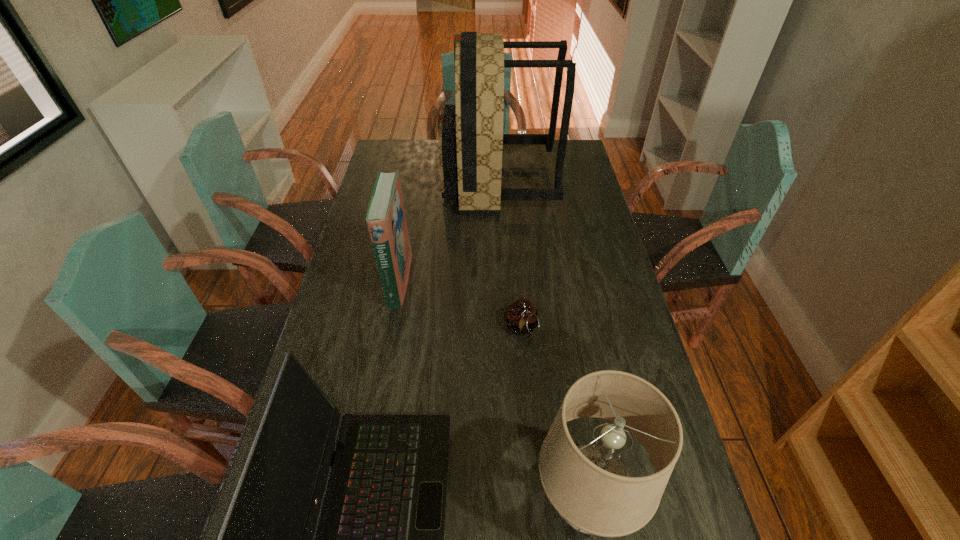
You are a GUI agent. You are given a task and a screenshot of the screen. Output one action in this format:
    pyautogui.click(x=<x>, y=<y>)
    Task: Click on the farthest object
    The width and height of the screenshot is (960, 540).
    Given the screenshot: What is the action you would take?
    pyautogui.click(x=471, y=139)

Locate an element on the screen. This screenshot has width=960, height=540. the tallest object is located at coordinates (471, 139).

Identify the location of hardback book. The width and height of the screenshot is (960, 540). (386, 220).

Where is `the third farthest object`? The height and width of the screenshot is (540, 960). the third farthest object is located at coordinates (521, 318).

You are a GUI agent. You are given a task and a screenshot of the screen. Output one action in this format:
    pyautogui.click(x=<x>, y=<y>)
    Task: Click on the pinecone
    The image size is (960, 540).
    Given the screenshot: What is the action you would take?
    pyautogui.click(x=521, y=318)

The image size is (960, 540). I want to click on vacant space situated on the front face of the farthest object, so (390, 183).

Locate an element on the screen. This screenshot has width=960, height=540. free space located 0.300m on the front face of the farthest object is located at coordinates (371, 183).

This screenshot has width=960, height=540. Find the location of `free region located 0.130m on the front face of the farthest object`. free region located 0.130m on the front face of the farthest object is located at coordinates (411, 183).

Find the location of a particular element. Image resolution: width=960 pixels, height=540 pixels. free location located on the cover of the second farthest object is located at coordinates (486, 280).

In order to click on vacant position located 0.160m with a leaf charm attached to the shortest object in this screenshot , I will do `click(527, 395)`.